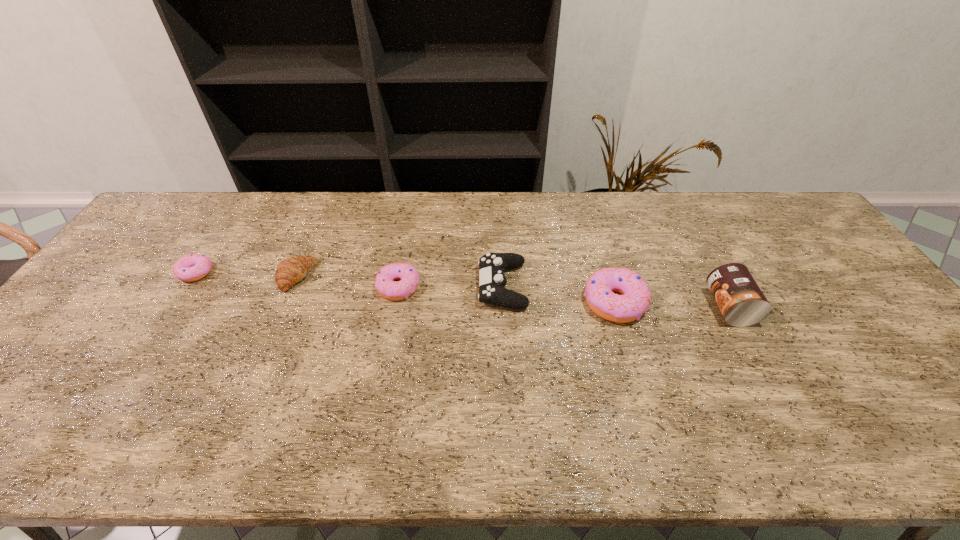
Locate an element on the screen. The image size is (960, 540). object that is the closest one to the crescent roll is located at coordinates (387, 287).

Locate an element on the screen. the second closest doughnut to the fourth object from left to right is located at coordinates (387, 287).

The image size is (960, 540). Find the location of `the second closest doughnut to the shortest object`. the second closest doughnut to the shortest object is located at coordinates (599, 291).

Image resolution: width=960 pixels, height=540 pixels. Find the location of `vacant region that satisfies the following two spatial constraints: 1. on the front side of the crescent roll; 2. on the right side of the shortest object`. vacant region that satisfies the following two spatial constraints: 1. on the front side of the crescent roll; 2. on the right side of the shortest object is located at coordinates (193, 276).

In order to click on free space that satisfies the following two spatial constraints: 1. on the surface of the second object from right to left; 2. on the right side of the control in this screenshot , I will do `click(503, 302)`.